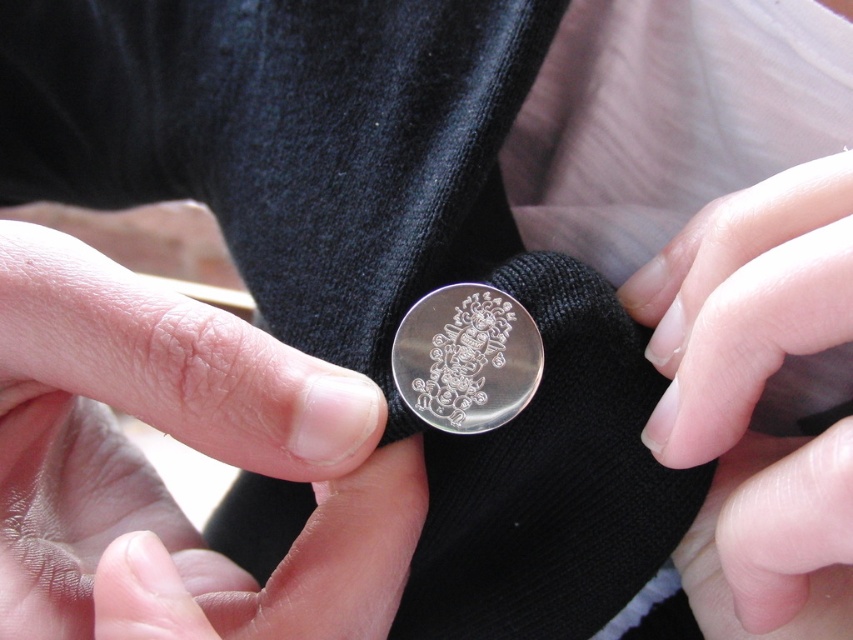
Question: In this image, where is nail polish at center located relative to silver polished coin at center?

Choices:
 (A) below
 (B) above

Answer: (A)

Question: Which is farther from the smooth silver coin at center?

Choices:
 (A) nail polish at center
 (B) silver polished coin at center

Answer: (A)

Question: Is smooth silver coin at center smaller than silver polished coin at center?

Choices:
 (A) yes
 (B) no

Answer: (B)

Question: Is smooth silver coin at center bigger than nail polish at center?

Choices:
 (A) yes
 (B) no

Answer: (A)

Question: Which point appears closest to the camera in this image?

Choices:
 (A) (480, 413)
 (B) (90, 376)
 (C) (688, 236)

Answer: (B)

Question: Which object is positioned closest to the nail polish at center?

Choices:
 (A) smooth silver coin at center
 (B) silver polished coin at center

Answer: (B)